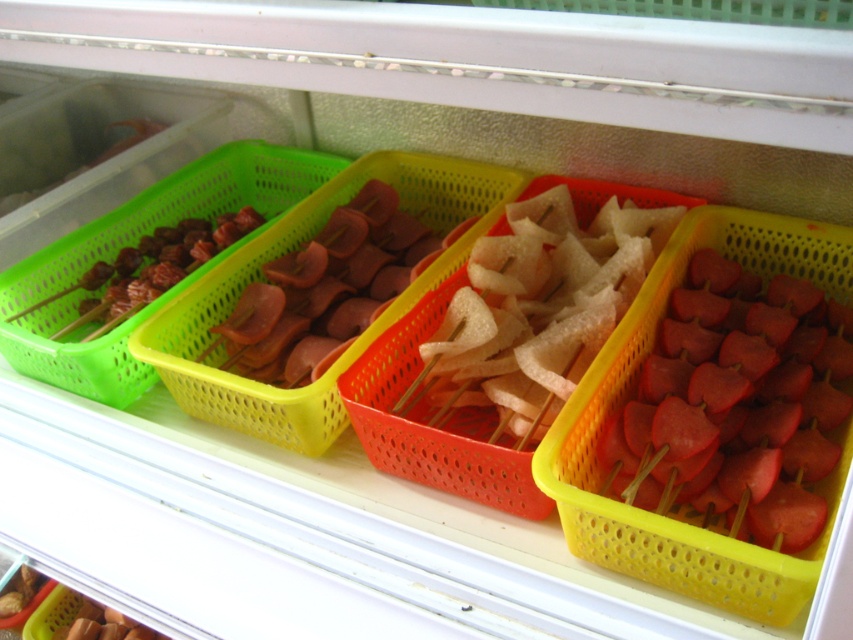
You are a customer at a food stall and see the translucent white skewers at center and the green plastic tray at center in the display case. Which item is shorter in height?

The translucent white skewers at center are shorter in height compared to the green plastic tray at center.

You are a customer at a food stall and see the translucent white skewers at center and the green plastic tray at center. Which one is positioned to the right?

The translucent white skewers at center is positioned to the right of the green plastic tray at center.